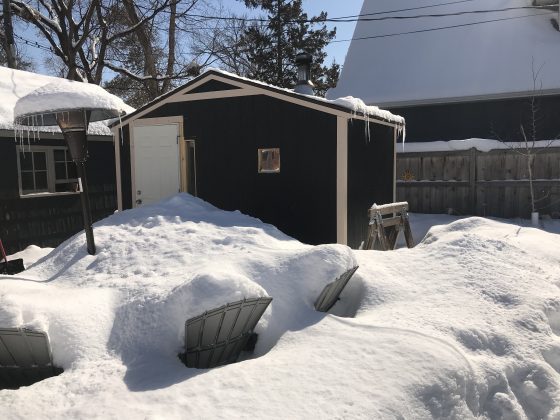
You are a GUI agent. You are given a task and a screenshot of the screen. Output one action in this format:
    pyautogui.click(x=<x>, y=<y>)
    Task: Click on the 3 windows
    The height and width of the screenshot is (420, 560).
    Given the screenshot: What is the action you would take?
    pyautogui.click(x=46, y=181), pyautogui.click(x=59, y=174), pyautogui.click(x=279, y=157)